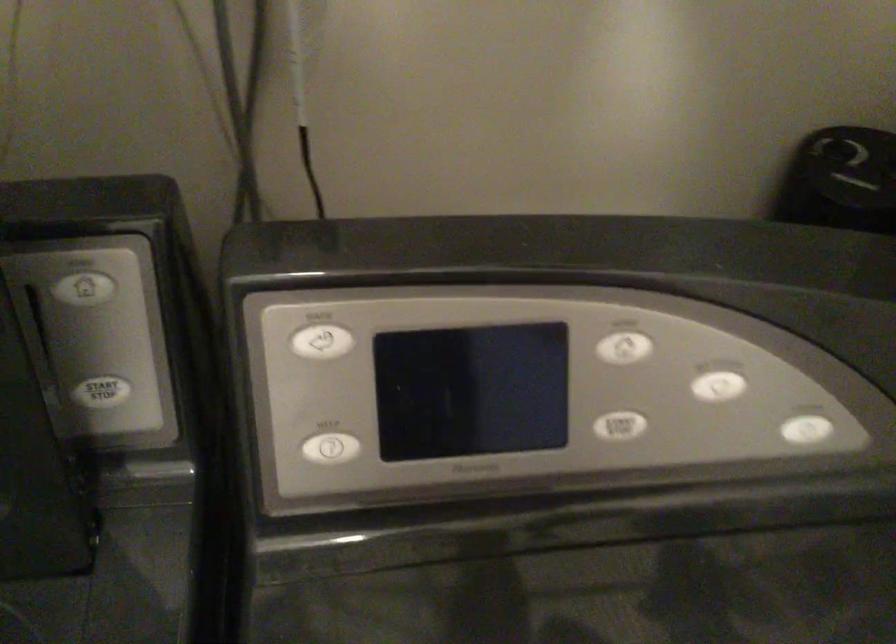
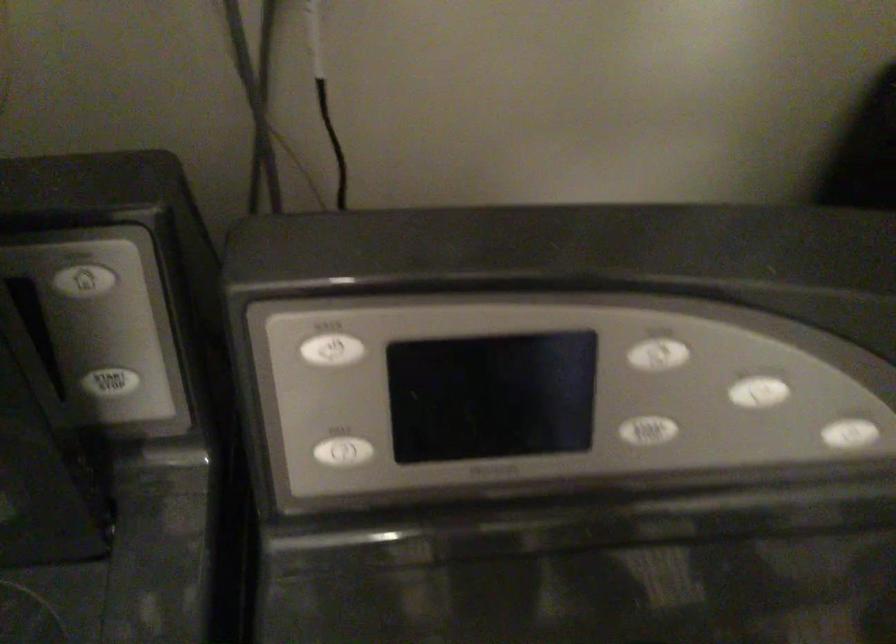
The point at (319, 342) is marked in the first image. Where is the corresponding point in the second image?

(332, 350)